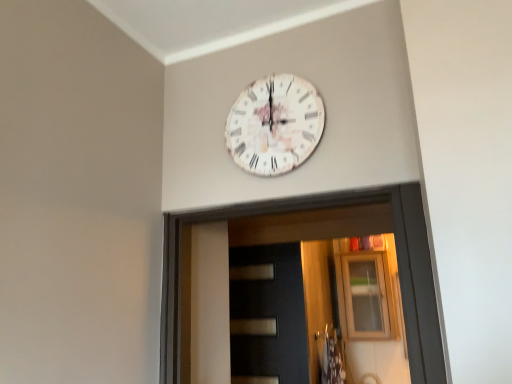
Question: Is transparent glass cabinet at upper center bigger than white paper-like clock at upper center?

Choices:
 (A) no
 (B) yes

Answer: (B)

Question: From the image's perspective, does transparent glass cabinet at upper center appear lower than white paper-like clock at upper center?

Choices:
 (A) no
 (B) yes

Answer: (B)

Question: Is transparent glass cabinet at upper center aimed at white paper-like clock at upper center?

Choices:
 (A) yes
 (B) no

Answer: (A)

Question: Is transparent glass cabinet at upper center next to white paper-like clock at upper center and touching it?

Choices:
 (A) no
 (B) yes

Answer: (A)

Question: Can white paper-like clock at upper center be found inside transparent glass cabinet at upper center?

Choices:
 (A) no
 (B) yes

Answer: (A)

Question: Relative to white paper-like clock at upper center, is dark matte door at center in front or behind?

Choices:
 (A) behind
 (B) front

Answer: (A)

Question: Is dark matte door at center taller or shorter than white paper-like clock at upper center?

Choices:
 (A) short
 (B) tall

Answer: (B)

Question: Is point (236, 284) closer or farther from the camera than point (272, 109)?

Choices:
 (A) farther
 (B) closer

Answer: (A)

Question: Is dark matte door at center situated inside white paper-like clock at upper center or outside?

Choices:
 (A) inside
 (B) outside

Answer: (B)

Question: Does point (289, 153) appear closer or farther from the camera than point (292, 342)?

Choices:
 (A) closer
 (B) farther

Answer: (A)

Question: Based on their sizes in the image, would you say white paper-like clock at upper center is bigger or smaller than dark matte door at center?

Choices:
 (A) big
 (B) small

Answer: (B)

Question: From a real-world perspective, is white paper-like clock at upper center physically located above or below dark matte door at center?

Choices:
 (A) below
 (B) above

Answer: (B)

Question: Considering their positions, is white paper-like clock at upper center located in front of or behind dark matte door at center?

Choices:
 (A) front
 (B) behind

Answer: (A)

Question: Is dark matte door at center inside or outside of transparent glass cabinet at upper center?

Choices:
 (A) inside
 (B) outside

Answer: (B)

Question: From the image's perspective, is dark matte door at center positioned above or below transparent glass cabinet at upper center?

Choices:
 (A) below
 (B) above

Answer: (B)